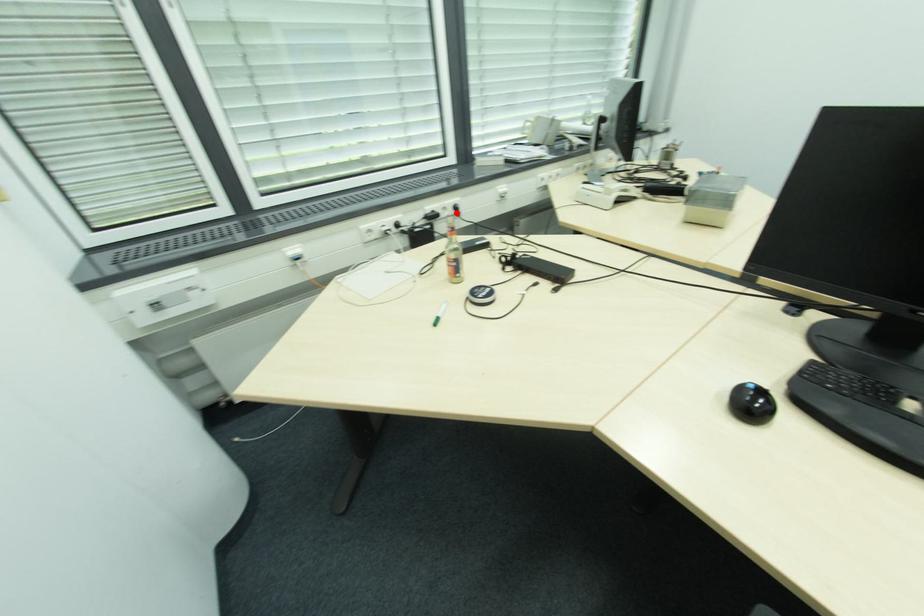
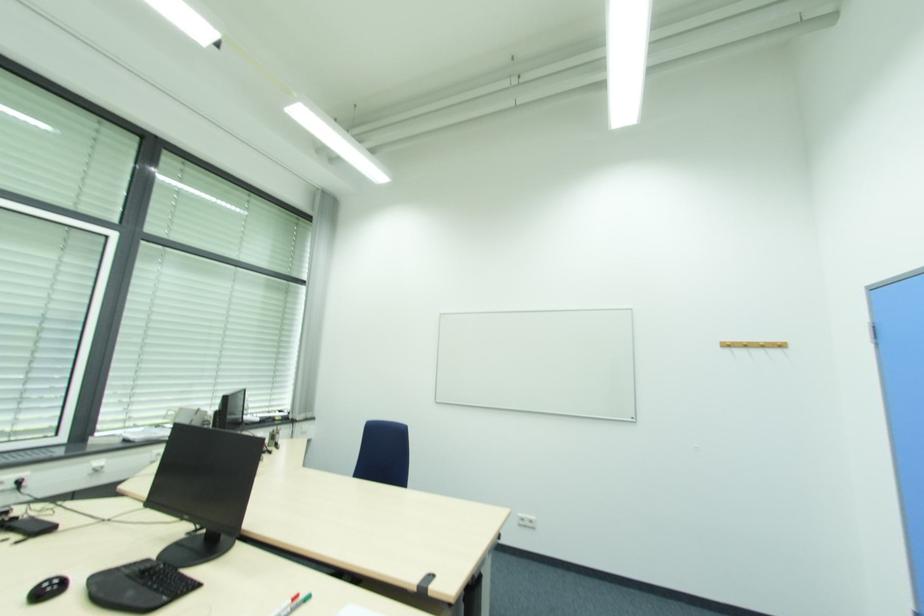
Question: I am providing you with two images of the same scene from different viewpoints. Image1 has a red point marked. In image2, the corresponding 3D location appears at what relative position? Reply with the corresponding letter.

Choices:
 (A) Closer
 (B) Farther

Answer: (A)